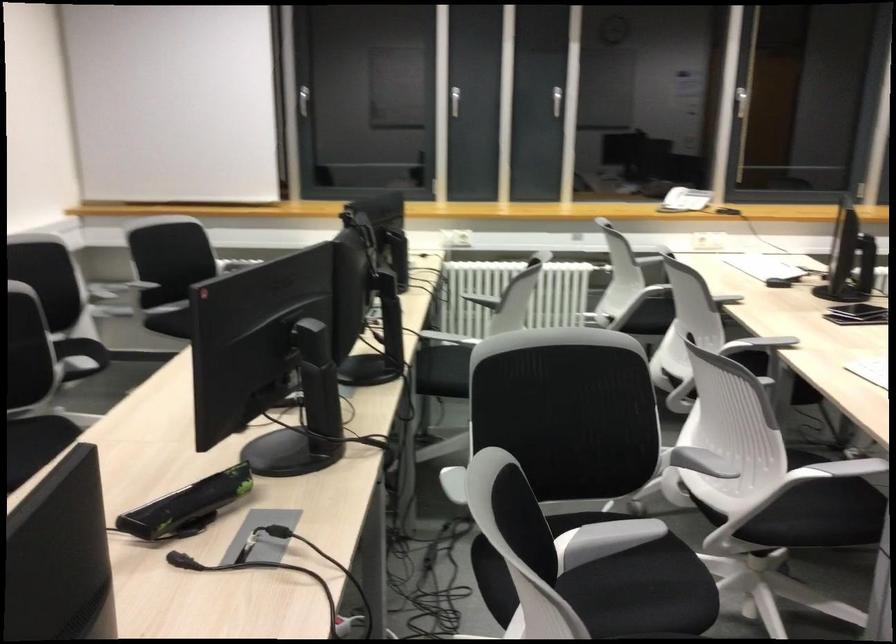
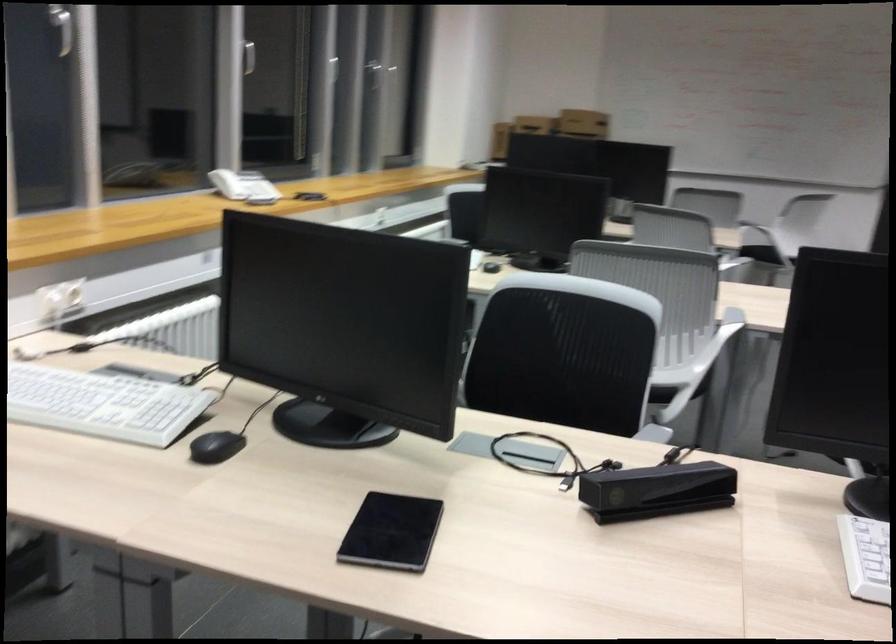
Find the pixel in the second image that matches point 650,375 in the first image.

(661, 395)